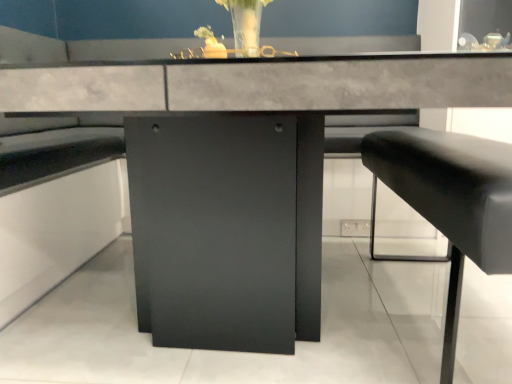
At what (x,y) coordinates should I click in order to perform the action: click on black leather cushion at right. Please return your answer as a coordinate pair (x, y). The image size is (512, 384). Looking at the image, I should click on (451, 202).

The height and width of the screenshot is (384, 512). Describe the element at coordinates (451, 202) in the screenshot. I see `black leather cushion at right` at that location.

Identify the location of translucent glass vase at upper center. (238, 33).

What do you see at coordinates (238, 33) in the screenshot? This screenshot has width=512, height=384. I see `translucent glass vase at upper center` at bounding box center [238, 33].

In order to click on black leather cushion at right in this screenshot , I will do `click(451, 202)`.

From the picture: Visually, is black leather cushion at right positioned to the left or to the right of translucent glass vase at upper center?

Clearly, black leather cushion at right is on the right of translucent glass vase at upper center in the image.

Relative to translucent glass vase at upper center, is black leather cushion at right in front or behind?

Clearly, black leather cushion at right is in front of translucent glass vase at upper center.

Is point (493, 143) more distant than point (212, 45)?

Yes, point (493, 143) is farther from viewer.

From the image's perspective, which is below, black leather cushion at right or translucent glass vase at upper center?

From the image's view, black leather cushion at right is below.

From a real-world perspective, which is physically below, black leather cushion at right or translucent glass vase at upper center?

From a 3D spatial view, black leather cushion at right is below.

Which of these two, black leather cushion at right or translucent glass vase at upper center, is wider?

Wider between the two is black leather cushion at right.

Considering the sizes of objects black leather cushion at right and translucent glass vase at upper center in the image provided, who is shorter, black leather cushion at right or translucent glass vase at upper center?

translucent glass vase at upper center.

Between black leather cushion at right and translucent glass vase at upper center, which one has smaller size?

Smaller between the two is translucent glass vase at upper center.

Is translucent glass vase at upper center a part of black leather cushion at right?

That's incorrect, translucent glass vase at upper center is not inside black leather cushion at right.

Is black leather cushion at right positioned far away from translucent glass vase at upper center?

No, black leather cushion at right is not far away from translucent glass vase at upper center.

Is black leather cushion at right positioned with its back to translucent glass vase at upper center?

No.

How far apart are black leather cushion at right and translucent glass vase at upper center?

black leather cushion at right and translucent glass vase at upper center are 20.73 inches apart from each other.

At what (x,y) coordinates should I click in order to perform the action: click on furniture lying on the right of translucent glass vase at upper center. Please return your answer as a coordinate pair (x, y). Image resolution: width=512 pixels, height=384 pixels. Looking at the image, I should click on (451, 202).

Considering the relative positions of translucent glass vase at upper center and black leather cushion at right in the image provided, is translucent glass vase at upper center to the right of black leather cushion at right from the viewer's perspective?

No, translucent glass vase at upper center is not to the right of black leather cushion at right.

Which is in front, translucent glass vase at upper center or black leather cushion at right?

black leather cushion at right.

Is point (233, 30) behind point (492, 165)?

Yes, it is.

From the image's perspective, between translucent glass vase at upper center and black leather cushion at right, which one is located above?

translucent glass vase at upper center appears higher in the image.

From a real-world perspective, is translucent glass vase at upper center physically above black leather cushion at right?

Yes.

Does translucent glass vase at upper center have a lesser width compared to black leather cushion at right?

Indeed, translucent glass vase at upper center has a lesser width compared to black leather cushion at right.

Is translucent glass vase at upper center taller or shorter than black leather cushion at right?

In the image, translucent glass vase at upper center appears to be shorter than black leather cushion at right.

Can you confirm if translucent glass vase at upper center is smaller than black leather cushion at right?

Indeed, translucent glass vase at upper center has a smaller size compared to black leather cushion at right.

Is translucent glass vase at upper center positioned beyond the bounds of black leather cushion at right?

Absolutely, translucent glass vase at upper center is external to black leather cushion at right.

Is translucent glass vase at upper center positioned far away from black leather cushion at right?

translucent glass vase at upper center is near black leather cushion at right, not far away.

Does translucent glass vase at upper center turn towards black leather cushion at right?

No, translucent glass vase at upper center is not oriented towards black leather cushion at right.

In the scene shown: How different are the orientations of translucent glass vase at upper center and black leather cushion at right in degrees?

They differ by 173 degrees in their facing directions.

This screenshot has height=384, width=512. I want to click on floral arrangement on the left of black leather cushion at right, so click(238, 33).

Identify the location of floral arrangement behind the black leather cushion at right. This screenshot has height=384, width=512. (238, 33).

This screenshot has width=512, height=384. What are the coordinates of `floral arrangement above the black leather cushion at right (from the image's perspective)` in the screenshot? It's located at (238, 33).